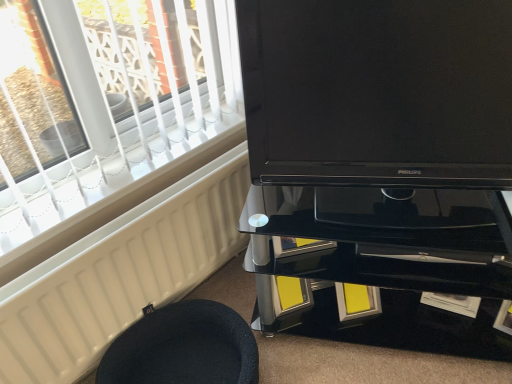
Question: Which is correct: white matte radiator at lower left is inside black fabric stool at lower left, or outside of it?

Choices:
 (A) outside
 (B) inside

Answer: (A)

Question: Looking at the image, does white matte radiator at lower left seem bigger or smaller compared to black fabric stool at lower left?

Choices:
 (A) small
 (B) big

Answer: (A)

Question: Estimate the real-world distances between objects in this image. Which object is farther from the matte black tv at center?

Choices:
 (A) black fabric stool at lower left
 (B) white matte radiator at lower left
 (C) black glass tv cabinet at center

Answer: (A)

Question: Which is farther from the black glass tv cabinet at center?

Choices:
 (A) black fabric stool at lower left
 (B) matte black tv at center
 (C) white matte radiator at lower left

Answer: (C)